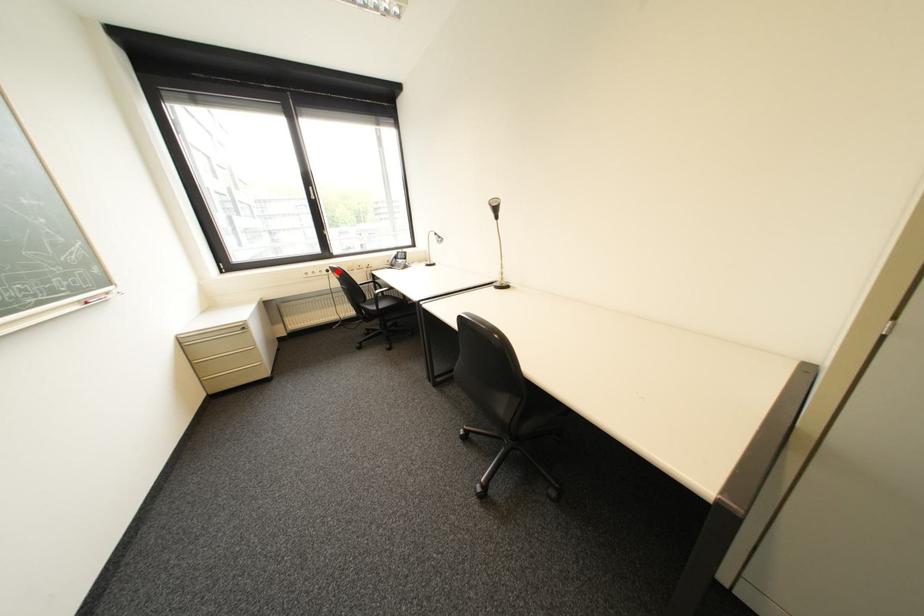
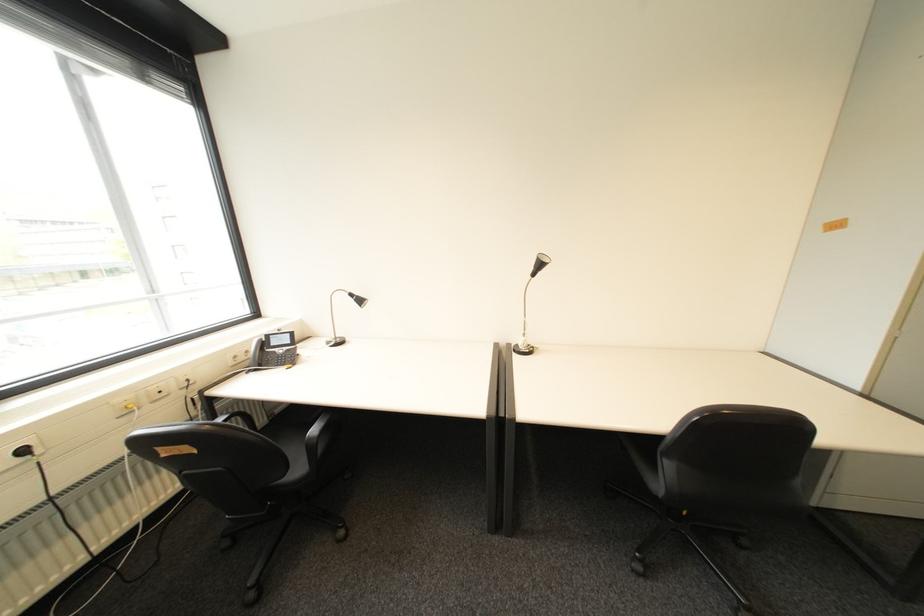
Locate, in the second image, the point that corresponds to the highlighted location in the first image.

(34, 452)